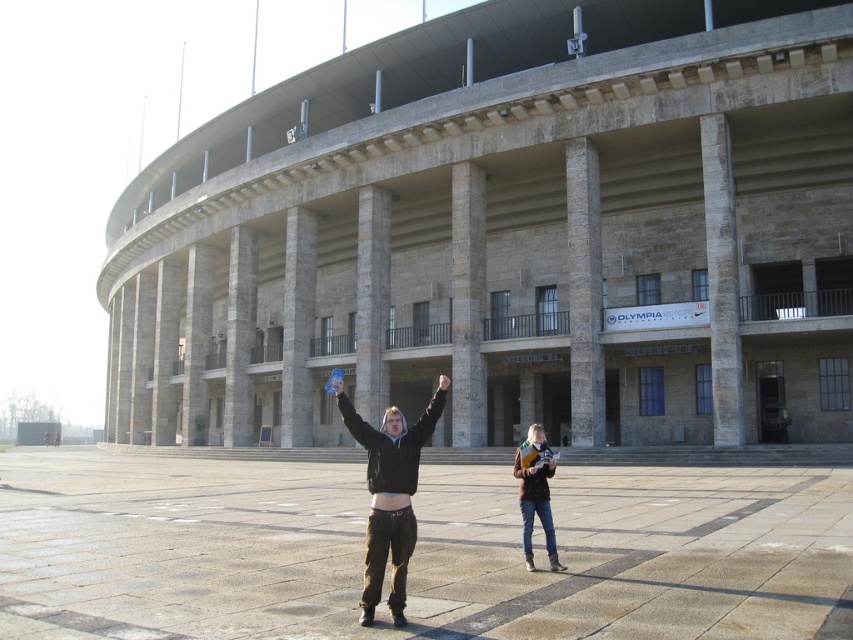
You are a security guard at the Olympiastadion Berlin. You notice two people in front of the stadium. One has a black matte arm at center and the other has a smooth skin hand at center. Which object is taller?

The black matte arm at center is taller than the smooth skin hand at center.

From the picture: You are standing in front of the stone gray stadium at center and the matte black hoodie at center. Which object is positioned to the right from your perspective?

The matte black hoodie at center is positioned to the right of the stone gray stadium at center.

You are a photographer setting up a tripod in front of the Olympiastadion Berlin. You notice two jackets on the ground in the center of the scene. The jackets are a brown leather jacket at center and a matte black hoodie at center. Which jacket should you focus on if you want to capture the one that appears taller in the photo?

The brown leather jacket at center is much taller than the matte black hoodie at center, so you should focus on the brown leather jacket at center to capture the taller one.